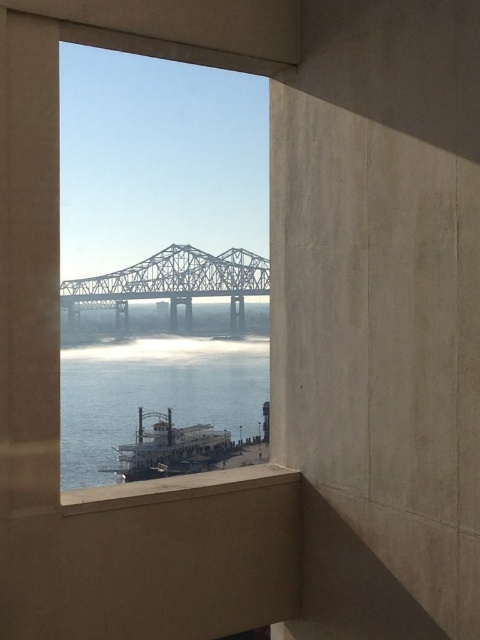
Can you confirm if metallic gray bridge at center is positioned below white wooden boat at lower center?

Incorrect, metallic gray bridge at center is not positioned below white wooden boat at lower center.

Between point (164, 248) and point (136, 461), which one is positioned behind?

The point (164, 248) is more distant.

Does point (181, 285) come in front of point (203, 428)?

No, (181, 285) is behind (203, 428).

Where is `metallic gray bridge at center`? metallic gray bridge at center is located at coordinates pos(172,284).

Which is in front, point (139, 371) or point (118, 280)?

Point (118, 280) is in front.

Is clear glass window at center further to the viewer compared to metallic gray bridge at center?

No, clear glass window at center is in front of metallic gray bridge at center.

I want to click on clear glass window at center, so click(159, 262).

Does clear glass window at center have a larger size compared to clear water at lower center?

Correct, clear glass window at center is larger in size than clear water at lower center.

Which is in front, point (83, 252) or point (163, 385)?

Point (163, 385) is more forward.

Image resolution: width=480 pixels, height=640 pixels. What are the coordinates of `clear glass window at center` in the screenshot? It's located at (159, 262).